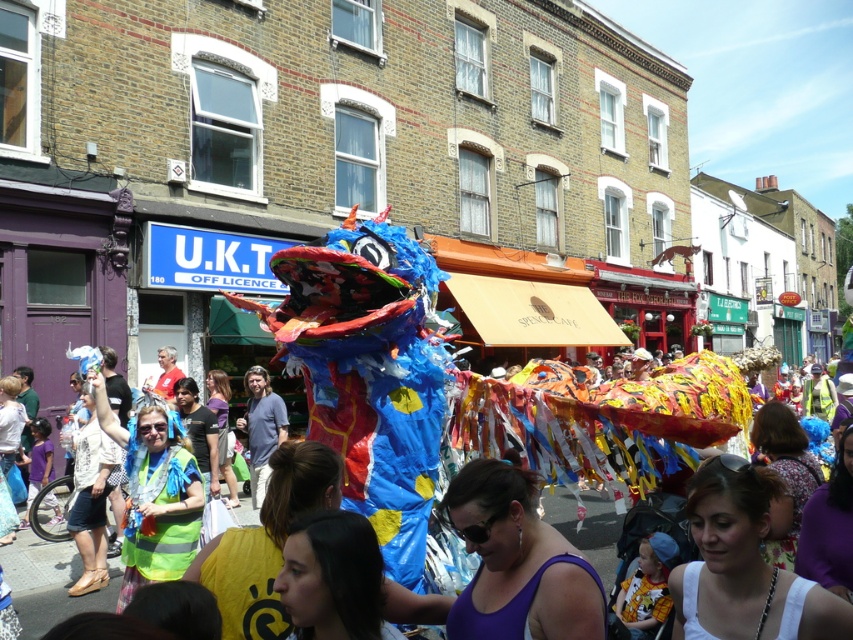
Is purple fabric at center positioned before colorful paper dragon at center?

Yes, purple fabric at center is in front of colorful paper dragon at center.

Does purple fabric at center have a larger size compared to colorful paper dragon at center?

Incorrect, purple fabric at center is not larger than colorful paper dragon at center.

Measure the distance between point (474, 577) and camera.

Point (474, 577) and camera are 6.04 meters apart.

Identify the location of purple fabric at center. The height and width of the screenshot is (640, 853). (515, 563).